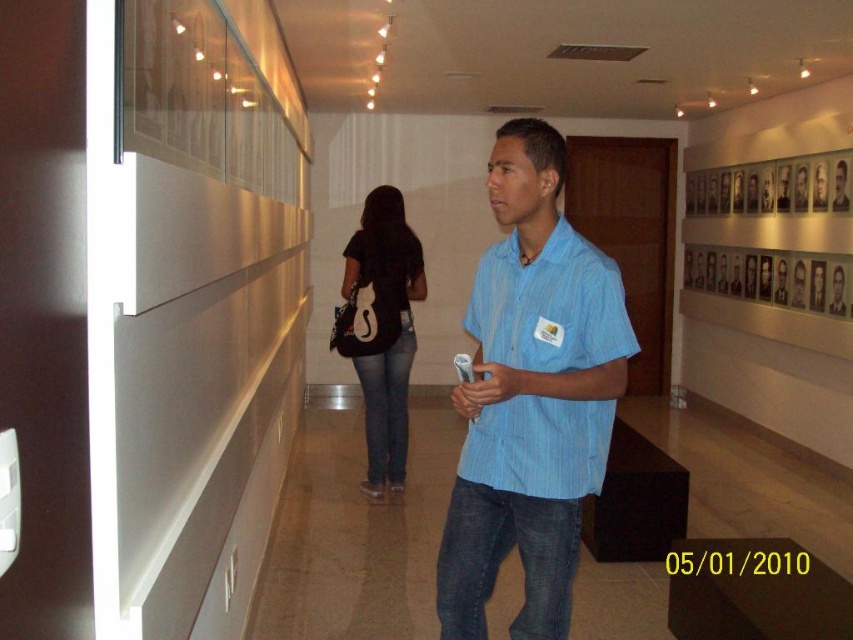
You are a security guard in the museum and need to check the distance between the black matte shirt at center and the blue denim jeans at center. According to the museum policy, the minimum required distance between two exhibits must be at least 4 inches. Is this pair of exhibits compliant with the policy?

The distance between the black matte shirt at center and the blue denim jeans at center is 3.83 inches, which is less than the required 4 inches. Therefore, this pair of exhibits does not comply with the museum policy.

You are an artist creating a detailed sketch of the man in the image. You need to decide which part of his outfit should be drawn first based on their relative sizes. Which item should you start with, the blue striped shirt at center or the blue denim jeans at center?

The blue striped shirt at center is larger in size than the blue denim jeans at center, so you should start with the blue striped shirt at center as it takes up more visual space.